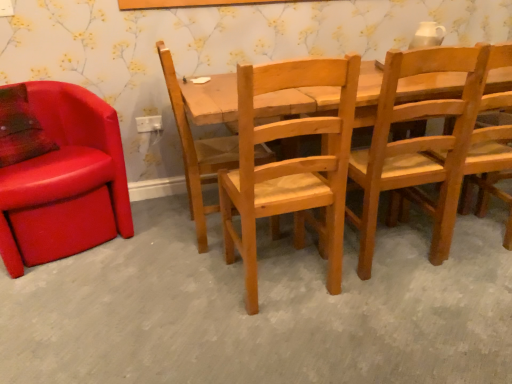
Find the location of `free space on the front side of natural wood chair at center, placed as the third chair when sorted from left to right`. free space on the front side of natural wood chair at center, placed as the third chair when sorted from left to right is located at coordinates (292, 342).